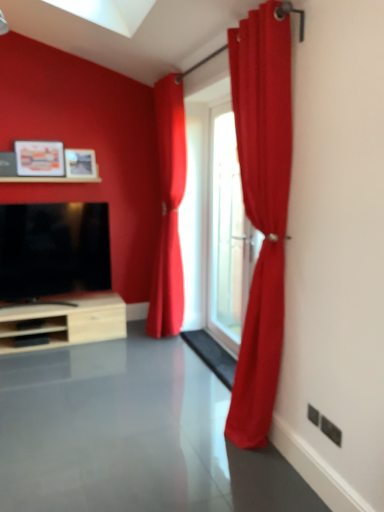
Image resolution: width=384 pixels, height=512 pixels. I want to click on matte wooden picture frame at upper left, placed as the first picture frame when sorted from right to left, so click(x=80, y=163).

This screenshot has width=384, height=512. What do you see at coordinates (80, 163) in the screenshot? I see `matte wooden picture frame at upper left, the second picture frame positioned from the left` at bounding box center [80, 163].

Find the location of a particular element. The image size is (384, 512). matte wooden picture frame at upper left, which is counted as the first picture frame, starting from the left is located at coordinates [x=40, y=158].

Can you confirm if transparent glass door at center is thinner than matte wooden picture frame at upper left, which is counted as the first picture frame, starting from the left?

Correct, the width of transparent glass door at center is less than that of matte wooden picture frame at upper left, which is counted as the first picture frame, starting from the left.

Is transparent glass door at center smaller than matte wooden picture frame at upper left, which is counted as the first picture frame, starting from the left?

No, transparent glass door at center is not smaller than matte wooden picture frame at upper left, which is counted as the first picture frame, starting from the left.

Between transparent glass door at center and matte wooden picture frame at upper left, the second picture frame when ordered from right to left, which one has more height?

With more height is transparent glass door at center.

Is transparent glass door at center positioned beyond the bounds of matte wooden picture frame at upper left, which is counted as the first picture frame, starting from the left?

Yes, transparent glass door at center is outside of matte wooden picture frame at upper left, which is counted as the first picture frame, starting from the left.

Is satin red curtain at center, placed as the first curtain when sorted from back to front, completely or partially outside of satin red curtain at right, which is counted as the 2th curtain, starting from the back?

satin red curtain at center, placed as the first curtain when sorted from back to front, is positioned outside satin red curtain at right, which is counted as the 2th curtain, starting from the back.

Is satin red curtain at center, placed as the first curtain when sorted from back to front, to the right of satin red curtain at right, which is counted as the 1th curtain, starting from the right, from the viewer's perspective?

No.

Considering the relative sizes of satin red curtain at center, placed as the first curtain when sorted from back to front, and satin red curtain at right, acting as the 2th curtain starting from the left, in the image provided, is satin red curtain at center, placed as the first curtain when sorted from back to front, smaller than satin red curtain at right, acting as the 2th curtain starting from the left,?

Yes, satin red curtain at center, placed as the first curtain when sorted from back to front, is smaller than satin red curtain at right, acting as the 2th curtain starting from the left.

Measure the distance from satin red curtain at center, which ranks as the second curtain in front-to-back order, to satin red curtain at right, acting as the 2th curtain starting from the left.

The distance of satin red curtain at center, which ranks as the second curtain in front-to-back order, from satin red curtain at right, acting as the 2th curtain starting from the left, is 1.55 meters.

From the picture: How different are the orientations of matte wooden picture frame at upper left, the second picture frame when ordered from right to left, and matte wooden picture frame at upper left, placed as the first picture frame when sorted from right to left, in degrees?

matte wooden picture frame at upper left, the second picture frame when ordered from right to left, and matte wooden picture frame at upper left, placed as the first picture frame when sorted from right to left, are facing 1.47 degrees away from each other.

In terms of width, does matte wooden picture frame at upper left, which is counted as the first picture frame, starting from the left, look wider or thinner when compared to matte wooden picture frame at upper left, placed as the first picture frame when sorted from right to left?

matte wooden picture frame at upper left, which is counted as the first picture frame, starting from the left, is thinner than matte wooden picture frame at upper left, placed as the first picture frame when sorted from right to left.

Locate an element on the screen. picture frame on the right of the matte wooden picture frame at upper left, which is counted as the first picture frame, starting from the left is located at coordinates (80, 163).

Is point (59, 145) farther from camera compared to point (79, 169)?

No, it is in front of (79, 169).

Based on the photo, does black glossy tv at left lie behind matte wooden picture frame at upper left, which is counted as the first picture frame, starting from the left?

No, the depth of black glossy tv at left is less than that of matte wooden picture frame at upper left, which is counted as the first picture frame, starting from the left.

From the image's perspective, would you say black glossy tv at left is positioned over matte wooden picture frame at upper left, which is counted as the first picture frame, starting from the left?

Incorrect, from the image's perspective, black glossy tv at left is lower than matte wooden picture frame at upper left, which is counted as the first picture frame, starting from the left.

Can you tell me how much black glossy tv at left and matte wooden picture frame at upper left, the second picture frame when ordered from right to left, differ in facing direction?

black glossy tv at left and matte wooden picture frame at upper left, the second picture frame when ordered from right to left, are facing 2.56 degrees away from each other.

Are black glossy tv at left and matte wooden picture frame at upper left, which is counted as the first picture frame, starting from the left, beside each other?

There is a gap between black glossy tv at left and matte wooden picture frame at upper left, which is counted as the first picture frame, starting from the left.

Which of these two, transparent glass door at center or black glossy tv at left, is thinner?

transparent glass door at center.

Considering the sizes of objects transparent glass door at center and black glossy tv at left in the image provided, who is shorter, transparent glass door at center or black glossy tv at left?

black glossy tv at left.

In the image, is transparent glass door at center positioned in front of or behind black glossy tv at left?

transparent glass door at center is positioned closer to the viewer than black glossy tv at left.

Considering the positions of objects transparent glass door at center and black glossy tv at left in the image provided, who is more to the right, transparent glass door at center or black glossy tv at left?

Positioned to the right is transparent glass door at center.

Is transparent glass door at center bigger than matte wooden picture frame at upper left, the second picture frame positioned from the left?

Correct, transparent glass door at center is larger in size than matte wooden picture frame at upper left, the second picture frame positioned from the left.

How distant is transparent glass door at center from matte wooden picture frame at upper left, the second picture frame positioned from the left?

The distance of transparent glass door at center from matte wooden picture frame at upper left, the second picture frame positioned from the left, is 1.43 meters.

From a real-world perspective, is transparent glass door at center physically located above or below matte wooden picture frame at upper left, the second picture frame positioned from the left?

Clearly, from a real-world perspective, transparent glass door at center is below matte wooden picture frame at upper left, the second picture frame positioned from the left.

From the image's perspective, is transparent glass door at center positioned above or below matte wooden picture frame at upper left, placed as the first picture frame when sorted from right to left?

transparent glass door at center is below matte wooden picture frame at upper left, placed as the first picture frame when sorted from right to left.

Considering the relative sizes of matte wooden picture frame at upper left, the second picture frame positioned from the left, and satin red curtain at center, the second curtain positioned from the right, in the image provided, is matte wooden picture frame at upper left, the second picture frame positioned from the left, wider than satin red curtain at center, the second curtain positioned from the right,?

No, matte wooden picture frame at upper left, the second picture frame positioned from the left, is not wider than satin red curtain at center, the second curtain positioned from the right.

Is matte wooden picture frame at upper left, placed as the first picture frame when sorted from right to left, looking in the opposite direction of satin red curtain at center, which appears as the 1th curtain when viewed from the left?

No, satin red curtain at center, which appears as the 1th curtain when viewed from the left, is not at the back of matte wooden picture frame at upper left, placed as the first picture frame when sorted from right to left.

Can you confirm if matte wooden picture frame at upper left, the second picture frame positioned from the left, is taller than satin red curtain at center, the second curtain positioned from the right?

No.

Who is more distant, matte wooden picture frame at upper left, placed as the first picture frame when sorted from right to left, or satin red curtain at center, the second curtain positioned from the right?

matte wooden picture frame at upper left, placed as the first picture frame when sorted from right to left, is further from the camera.

You are a GUI agent. You are given a task and a screenshot of the screen. Output one action in this format:
    pyautogui.click(x=<x>, y=<y>)
    Task: Click on the 2nd picture frame to the left when counting from the transparent glass door at center
    The height and width of the screenshot is (512, 384).
    Given the screenshot: What is the action you would take?
    pyautogui.click(x=40, y=158)

In the image, there is a satin red curtain at right, which is counted as the 2th curtain, starting from the back. Identify the location of curtain above it (from the image's perspective). The image size is (384, 512). (169, 209).

Based on the photo, when comparing their distances from matte wooden picture frame at upper left, which is counted as the first picture frame, starting from the left, does black glossy tv at left or satin red curtain at right, placed as the 1th curtain when sorted from front to back, seem closer?

Among the two, black glossy tv at left is located nearer to matte wooden picture frame at upper left, which is counted as the first picture frame, starting from the left.

Which object lies nearer to the anchor point transparent glass door at center, satin red curtain at right, which is counted as the 1th curtain, starting from the right, or satin red curtain at center, placed as the first curtain when sorted from back to front?

satin red curtain at center, placed as the first curtain when sorted from back to front.

From the image, which object appears to be farther from satin red curtain at right, placed as the 1th curtain when sorted from front to back, matte wooden picture frame at upper left, the second picture frame positioned from the left, or transparent glass door at center?

Among the two, matte wooden picture frame at upper left, the second picture frame positioned from the left, is located further to satin red curtain at right, placed as the 1th curtain when sorted from front to back.

When comparing their distances from black glossy tv at left, does satin red curtain at right, which is counted as the 1th curtain, starting from the right, or matte wooden picture frame at upper left, the second picture frame when ordered from right to left, seem further?

Based on the image, satin red curtain at right, which is counted as the 1th curtain, starting from the right, appears to be further to black glossy tv at left.

Estimate the real-world distances between objects in this image. Which object is further from black glossy tv at left, matte wooden picture frame at upper left, which is counted as the first picture frame, starting from the left, or satin red curtain at right, acting as the 2th curtain starting from the left?

satin red curtain at right, acting as the 2th curtain starting from the left, lies further to black glossy tv at left than the other object.

Considering their positions, is matte wooden picture frame at upper left, placed as the first picture frame when sorted from right to left, positioned further to satin red curtain at center, which appears as the 1th curtain when viewed from the left, than matte wooden picture frame at upper left, which is counted as the first picture frame, starting from the left?

Among the two, matte wooden picture frame at upper left, which is counted as the first picture frame, starting from the left, is located further to satin red curtain at center, which appears as the 1th curtain when viewed from the left.

Based on their spatial positions, is matte wooden picture frame at upper left, the second picture frame when ordered from right to left, or satin red curtain at center, which appears as the 1th curtain when viewed from the left, further from matte wooden picture frame at upper left, placed as the first picture frame when sorted from right to left?

satin red curtain at center, which appears as the 1th curtain when viewed from the left, is positioned further to the anchor matte wooden picture frame at upper left, placed as the first picture frame when sorted from right to left.

Which object lies further to the anchor point black glossy tv at left, matte wooden picture frame at upper left, the second picture frame positioned from the left, or transparent glass door at center?

Among the two, transparent glass door at center is located further to black glossy tv at left.

Identify the location of picture frame between satin red curtain at right, which is counted as the 2th curtain, starting from the back, and matte wooden picture frame at upper left, placed as the first picture frame when sorted from right to left, from front to back. (40, 158).

At what (x,y) coordinates should I click in order to perform the action: click on window between satin red curtain at right, which is counted as the 2th curtain, starting from the back, and matte wooden picture frame at upper left, the second picture frame when ordered from right to left, along the z-axis. Please return your answer as a coordinate pair (x, y). The height and width of the screenshot is (512, 384). Looking at the image, I should click on (228, 234).

Where is `picture frame situated between black glossy tv at left and satin red curtain at center, which ranks as the second curtain in front-to-back order, from left to right`? Image resolution: width=384 pixels, height=512 pixels. picture frame situated between black glossy tv at left and satin red curtain at center, which ranks as the second curtain in front-to-back order, from left to right is located at coordinates (80, 163).

Where is `picture frame between black glossy tv at left and transparent glass door at center from left to right`? picture frame between black glossy tv at left and transparent glass door at center from left to right is located at coordinates (80, 163).